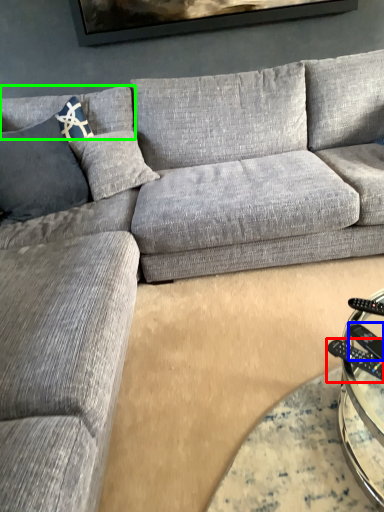
Question: Which object is positioned farthest from control (highlighted by a red box)? Select from remote (highlighted by a blue box) and pillow (highlighted by a green box).

Choices:
 (A) remote
 (B) pillow

Answer: (B)